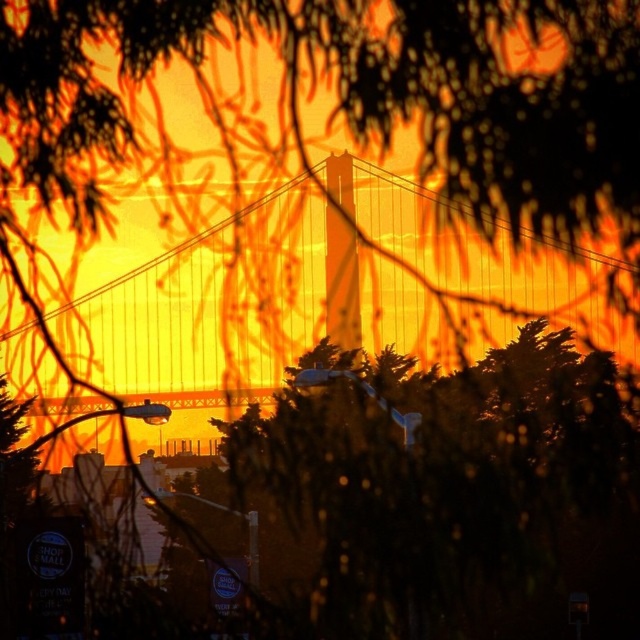
Question: Is dark green leafy tree at center above metallic suspension bridge at center?

Choices:
 (A) no
 (B) yes

Answer: (A)

Question: Which point is farther to the camera?

Choices:
 (A) metallic suspension bridge at center
 (B) dark green leafy tree at center

Answer: (A)

Question: Can you confirm if dark green leafy tree at center is smaller than metallic suspension bridge at center?

Choices:
 (A) no
 (B) yes

Answer: (A)

Question: Is dark green leafy tree at center below metallic suspension bridge at center?

Choices:
 (A) no
 (B) yes

Answer: (B)

Question: Which object is closer to the camera taking this photo?

Choices:
 (A) dark green leafy tree at center
 (B) metallic suspension bridge at center

Answer: (A)